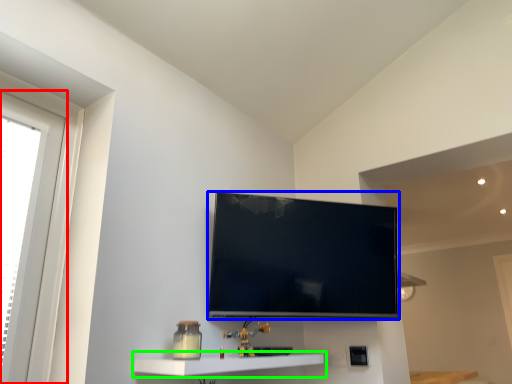
Question: Based on their relative distances, which object is nearer to window (highlighted by a red box)? Choose from television (highlighted by a blue box) and shelf (highlighted by a green box).

Choices:
 (A) television
 (B) shelf

Answer: (B)